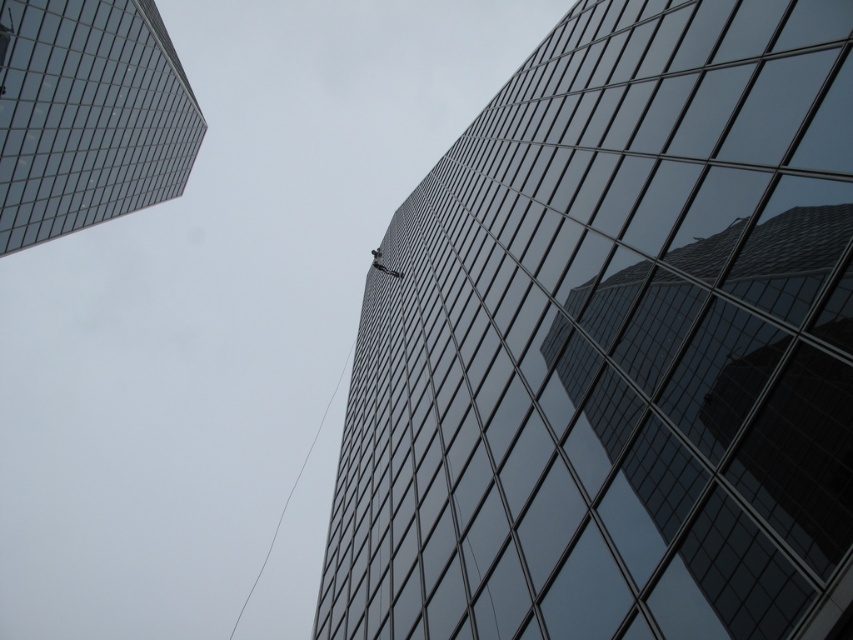
Which is behind, point (521, 310) or point (9, 208)?

The point (9, 208) is behind.

Does glossy glass building at center appear on the right side of transparent glass skyscraper at upper left?

Yes, glossy glass building at center is to the right of transparent glass skyscraper at upper left.

Does point (706, 592) lie behind point (50, 93)?

No, it is in front of (50, 93).

Locate an element on the screen. The width and height of the screenshot is (853, 640). glossy glass building at center is located at coordinates (614, 346).